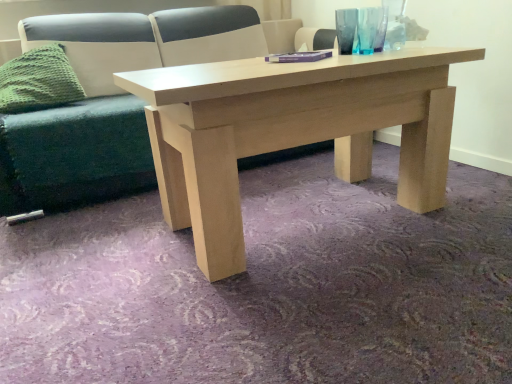
Question: From a real-world perspective, is green fabric couch at center on purple matte book at center?

Choices:
 (A) yes
 (B) no

Answer: (B)

Question: Does green fabric couch at center have a lesser width compared to purple matte book at center?

Choices:
 (A) no
 (B) yes

Answer: (A)

Question: Does green fabric couch at center come behind purple matte book at center?

Choices:
 (A) yes
 (B) no

Answer: (A)

Question: From the image's perspective, is green fabric couch at center below purple matte book at center?

Choices:
 (A) yes
 (B) no

Answer: (B)

Question: From a real-world perspective, is green fabric couch at center below purple matte book at center?

Choices:
 (A) yes
 (B) no

Answer: (A)

Question: From the image's perspective, is transparent glass vase at upper right positioned above or below purple matte book at center?

Choices:
 (A) below
 (B) above

Answer: (B)

Question: In the image, is transparent glass vase at upper right positioned in front of or behind purple matte book at center?

Choices:
 (A) front
 (B) behind

Answer: (B)

Question: Considering the positions of point (373, 13) and point (268, 61), is point (373, 13) closer or farther from the camera than point (268, 61)?

Choices:
 (A) farther
 (B) closer

Answer: (A)

Question: Considering the positions of transparent glass vase at upper right and purple matte book at center in the image, is transparent glass vase at upper right taller or shorter than purple matte book at center?

Choices:
 (A) short
 (B) tall

Answer: (B)

Question: From their relative heights in the image, would you say purple matte book at center is taller or shorter than green fabric couch at center?

Choices:
 (A) short
 (B) tall

Answer: (A)

Question: Is purple matte book at center inside the boundaries of green fabric couch at center, or outside?

Choices:
 (A) inside
 (B) outside

Answer: (B)

Question: From the image's perspective, is purple matte book at center positioned above or below green fabric couch at center?

Choices:
 (A) below
 (B) above

Answer: (A)

Question: From a real-world perspective, is purple matte book at center positioned above or below green fabric couch at center?

Choices:
 (A) above
 (B) below

Answer: (A)

Question: Looking at the image, does green fabric couch at center seem bigger or smaller compared to green knitted pillow at left?

Choices:
 (A) big
 (B) small

Answer: (A)

Question: Is green fabric couch at center in front of or behind green knitted pillow at left in the image?

Choices:
 (A) front
 (B) behind

Answer: (A)